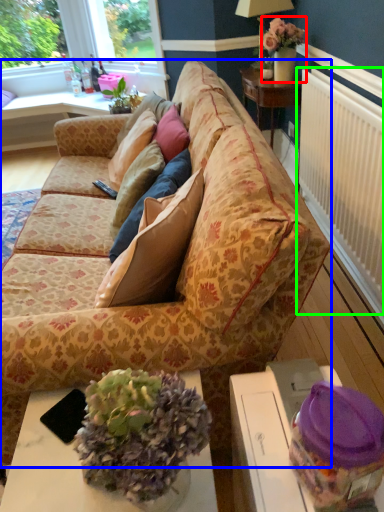
Question: Which object is positioned closest to houseplant (highlighted by a red box)? Select from studio couch (highlighted by a blue box) and radiator (highlighted by a green box).

Choices:
 (A) studio couch
 (B) radiator

Answer: (B)